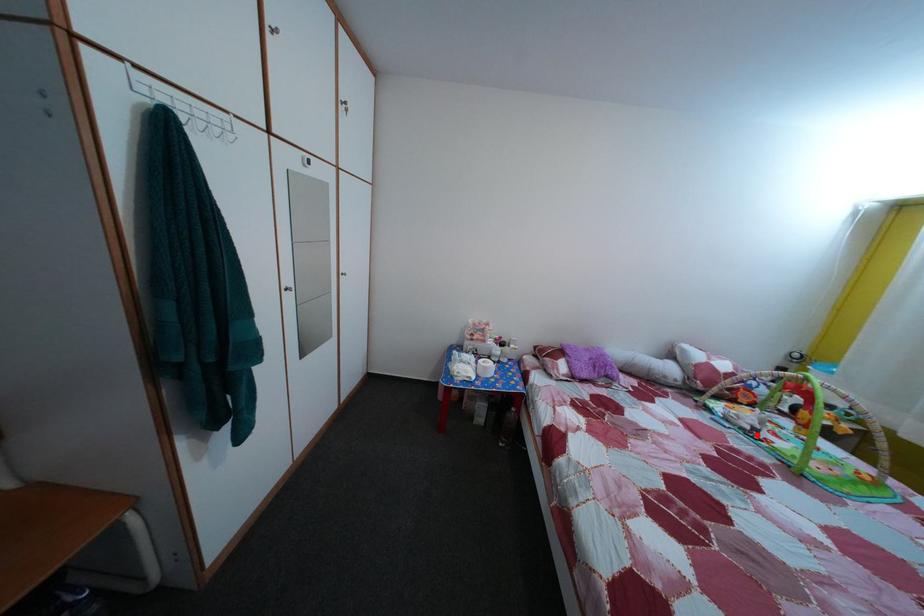
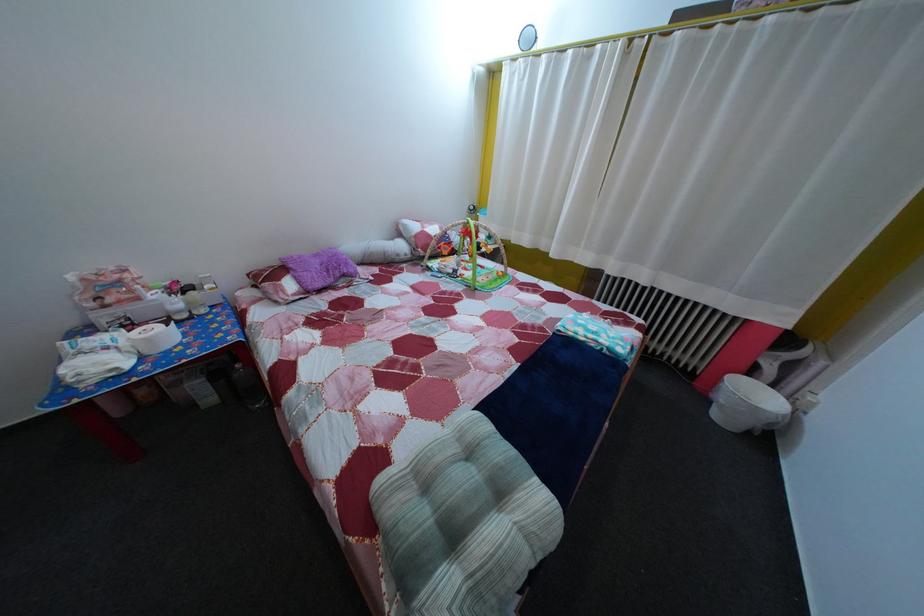
In the second image, find the point that corresponds to the highlighted location in the first image.

(459, 278)